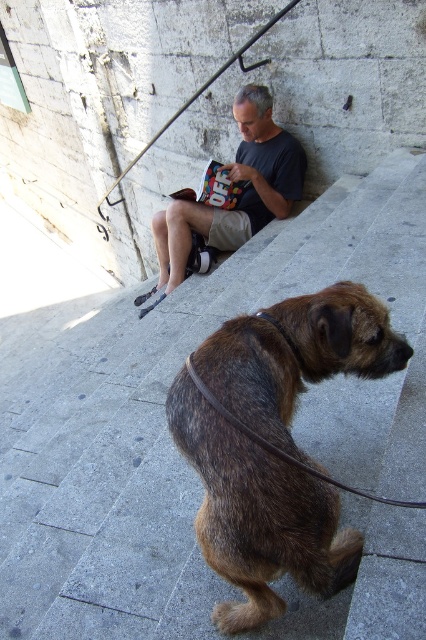
Between brown shaggy dog at lower center and dark blue t-shirt at center, which one appears on the left side from the viewer's perspective?

dark blue t-shirt at center

Which is above, brown shaggy dog at lower center or dark blue t-shirt at center?

dark blue t-shirt at center is above.

Between point (273, 547) and point (265, 96), which one is positioned behind?

The point (265, 96) is more distant.

You are a GUI agent. You are given a task and a screenshot of the screen. Output one action in this format:
    pyautogui.click(x=<x>, y=<y>)
    Task: Click on the brown shaggy dog at lower center
    This screenshot has height=640, width=426.
    Given the screenshot: What is the action you would take?
    pyautogui.click(x=258, y=515)

From the picture: Can you confirm if brown shaggy dog at lower center is positioned below brown leather leash at lower center?

Actually, brown shaggy dog at lower center is above brown leather leash at lower center.

Is the position of brown shaggy dog at lower center less distant than that of brown leather leash at lower center?

No, brown shaggy dog at lower center is further to the viewer.

Describe the element at coordinates (258, 515) in the screenshot. I see `brown shaggy dog at lower center` at that location.

Find the location of a particular element. Image resolution: width=426 pixels, height=640 pixels. brown shaggy dog at lower center is located at coordinates (258, 515).

Can you confirm if dark blue t-shirt at center is shorter than brown leather leash at lower center?

Incorrect, dark blue t-shirt at center's height does not fall short of brown leather leash at lower center's.

Who is more distant from viewer, (x=195, y=202) or (x=368, y=493)?

The point (x=195, y=202) is behind.

Between point (256, 195) and point (279, 451), which one is positioned behind?

The point (256, 195) is behind.

At what (x,y) coordinates should I click in order to perform the action: click on dark blue t-shirt at center. Please return your answer as a coordinate pair (x, y). The image size is (426, 640). Looking at the image, I should click on (236, 193).